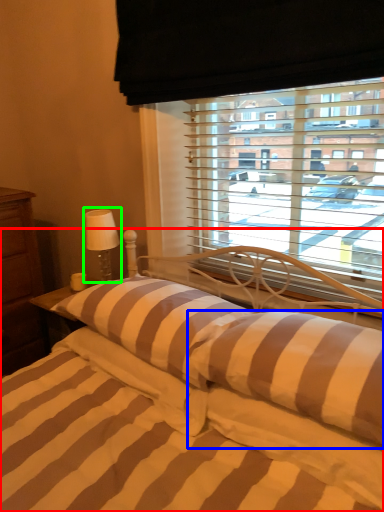
Question: Based on their relative distances, which object is nearer to bed (highlighted by a red box)? Choose from pillow (highlighted by a blue box) and table lamp (highlighted by a green box).

Choices:
 (A) pillow
 (B) table lamp

Answer: (A)